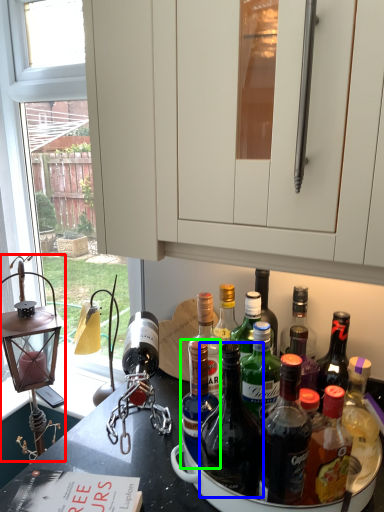
Question: Which object is the closest to the oil lamp (highlighted by a red box)? Choose among these: bottle (highlighted by a blue box) or bottle (highlighted by a green box).

Choices:
 (A) bottle
 (B) bottle

Answer: (B)